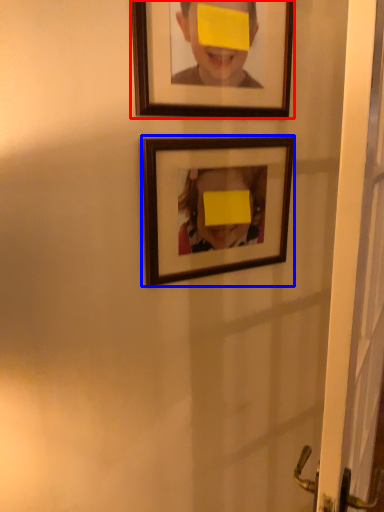
Question: Among these objects, which one is farthest to the camera, picture frame (highlighted by a red box) or picture frame (highlighted by a blue box)?

Choices:
 (A) picture frame
 (B) picture frame

Answer: (B)